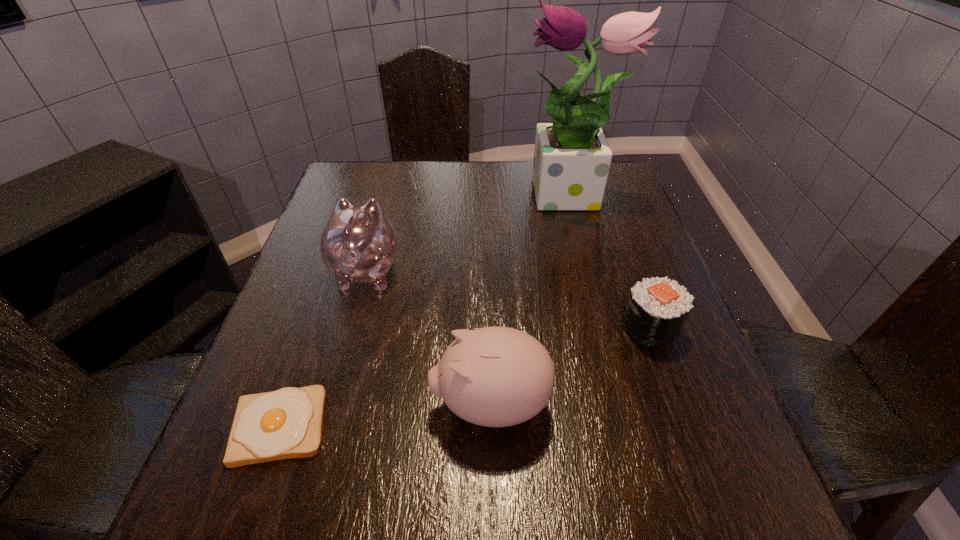
You are a GUI agent. You are given a task and a screenshot of the screen. Output one action in this format:
    pyautogui.click(x=<x>, y=<y>)
    Task: Click on the farthest object
    The height and width of the screenshot is (540, 960).
    Given the screenshot: What is the action you would take?
    pyautogui.click(x=572, y=157)

Where is `flower arrangement`? The image size is (960, 540). flower arrangement is located at coordinates (572, 157).

Where is `the farther piggy bank`? the farther piggy bank is located at coordinates (358, 245).

At what (x,y) coordinates should I click in order to perform the action: click on the left piggy bank. Please return your answer as a coordinate pair (x, y). This screenshot has height=540, width=960. Looking at the image, I should click on (358, 245).

I want to click on the right piggy bank, so click(495, 376).

This screenshot has width=960, height=540. Identify the location of the third nearest object. (656, 309).

I want to click on sushi, so click(656, 309).

I want to click on toast, so click(x=287, y=423).

I want to click on free region located on the front-facing side of the tallest object, so click(456, 198).

This screenshot has width=960, height=540. In order to click on free space located 0.170m on the front-facing side of the tallest object in this screenshot , I will do `click(460, 198)`.